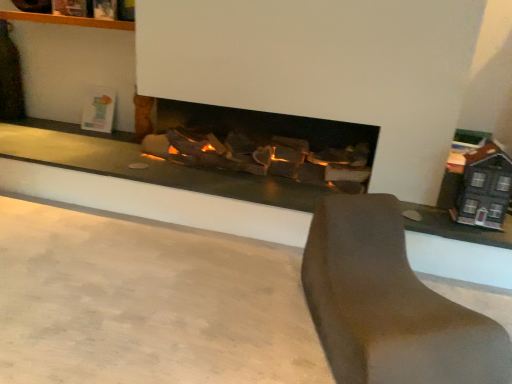
Question: From the image's perspective, would you say smooth concrete at center is shown under brown matte chair at lower right?

Choices:
 (A) no
 (B) yes

Answer: (B)

Question: Can you confirm if smooth concrete at center is taller than brown matte chair at lower right?

Choices:
 (A) yes
 (B) no

Answer: (B)

Question: Can we say smooth concrete at center lies outside brown matte chair at lower right?

Choices:
 (A) yes
 (B) no

Answer: (A)

Question: Is smooth concrete at center thinner than brown matte chair at lower right?

Choices:
 (A) yes
 (B) no

Answer: (B)

Question: Is smooth concrete at center positioned in front of brown matte chair at lower right?

Choices:
 (A) no
 (B) yes

Answer: (B)

Question: From the image's perspective, is smooth concrete at center on top of brown matte chair at lower right?

Choices:
 (A) yes
 (B) no

Answer: (B)

Question: Are brown matte chair at lower right and smooth concrete at center far apart?

Choices:
 (A) yes
 (B) no

Answer: (B)

Question: Is brown matte chair at lower right to the right of smooth concrete at center from the viewer's perspective?

Choices:
 (A) no
 (B) yes

Answer: (B)

Question: Considering the relative sizes of brown matte chair at lower right and smooth concrete at center in the image provided, is brown matte chair at lower right wider than smooth concrete at center?

Choices:
 (A) yes
 (B) no

Answer: (B)

Question: Is brown matte chair at lower right not inside smooth concrete at center?

Choices:
 (A) no
 (B) yes

Answer: (B)

Question: Is smooth concrete at center surrounded by brown matte chair at lower right?

Choices:
 (A) no
 (B) yes

Answer: (A)

Question: From a real-world perspective, is brown matte chair at lower right beneath smooth concrete at center?

Choices:
 (A) yes
 (B) no

Answer: (B)

Question: Is smooth concrete at center situated inside brown matte chair at lower right or outside?

Choices:
 (A) outside
 (B) inside

Answer: (A)